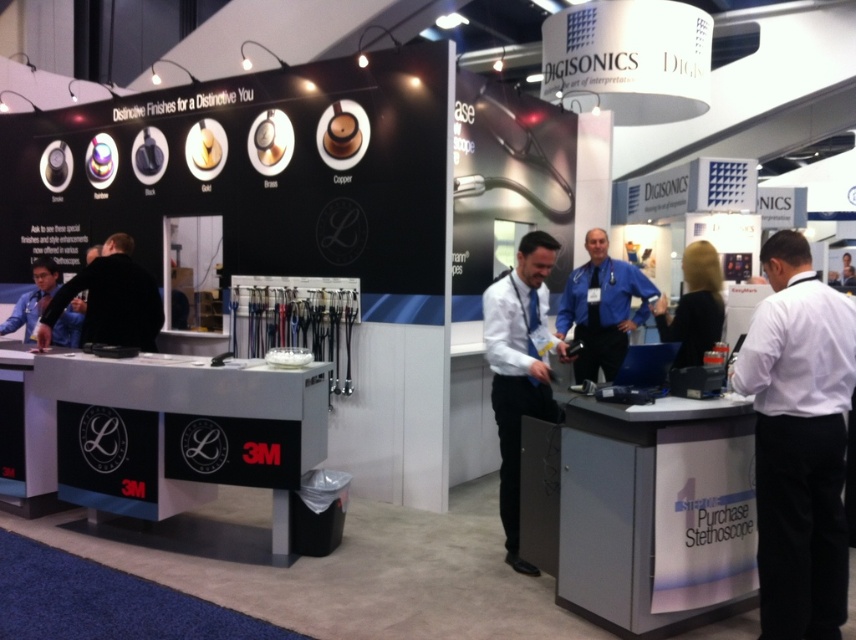
Question: Which point appears farthest from the camera in this image?

Choices:
 (A) (128, 308)
 (B) (795, 282)

Answer: (A)

Question: Which point is closer to the camera?

Choices:
 (A) (132, 289)
 (B) (590, 336)
 (C) (495, 410)

Answer: (C)

Question: Which object is the farthest from the black matte jacket at left?

Choices:
 (A) blue uniform at center
 (B) white shirt at right

Answer: (B)

Question: Is white glossy shirt at center thinner than black matte jacket at left?

Choices:
 (A) no
 (B) yes

Answer: (B)

Question: Is blue uniform at center to the left of black matte jacket at left from the viewer's perspective?

Choices:
 (A) no
 (B) yes

Answer: (A)

Question: Does white shirt at right have a lesser width compared to black matte jacket at left?

Choices:
 (A) no
 (B) yes

Answer: (B)